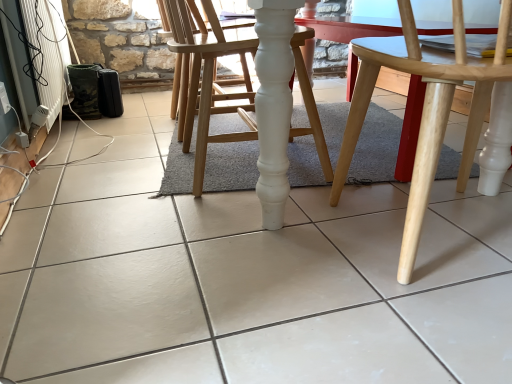
Find the location of a particular element. Image resolution: width=512 pixels, height=384 pixels. free space to the left of natural wood chair at center, which is the 1th chair from right to left is located at coordinates (259, 264).